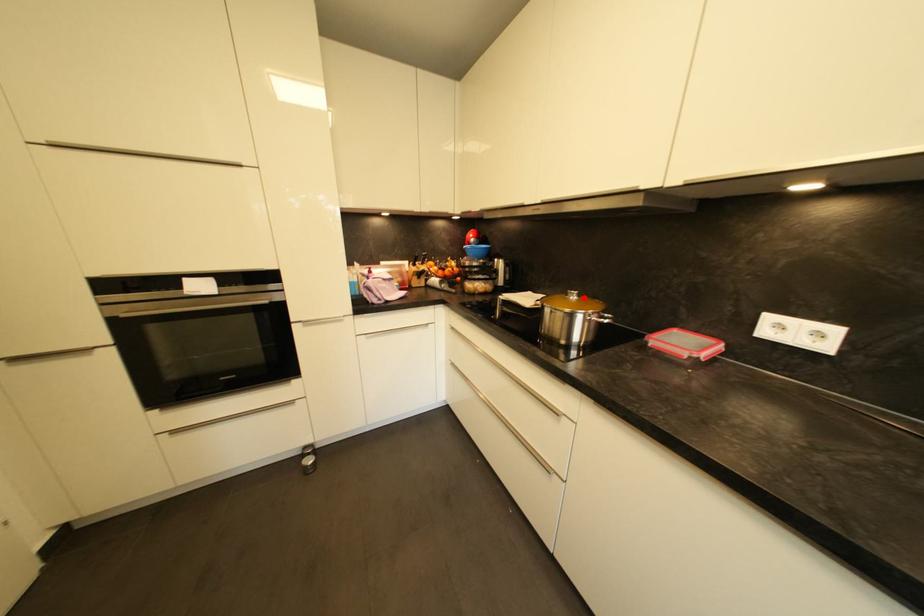
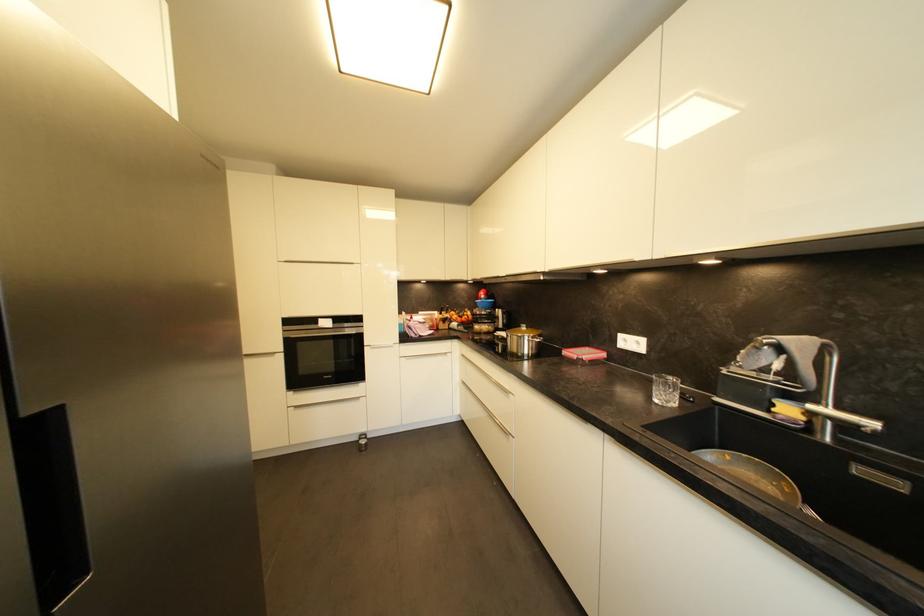
Where in the second image is the point corresponding to the highlighted location from the first image?

(531, 330)